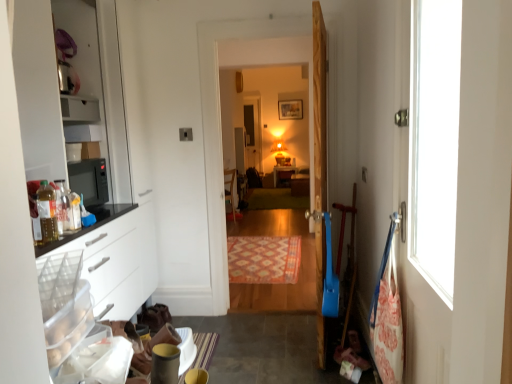
Where is `free space to the left of wooden door at center`? free space to the left of wooden door at center is located at coordinates (264, 344).